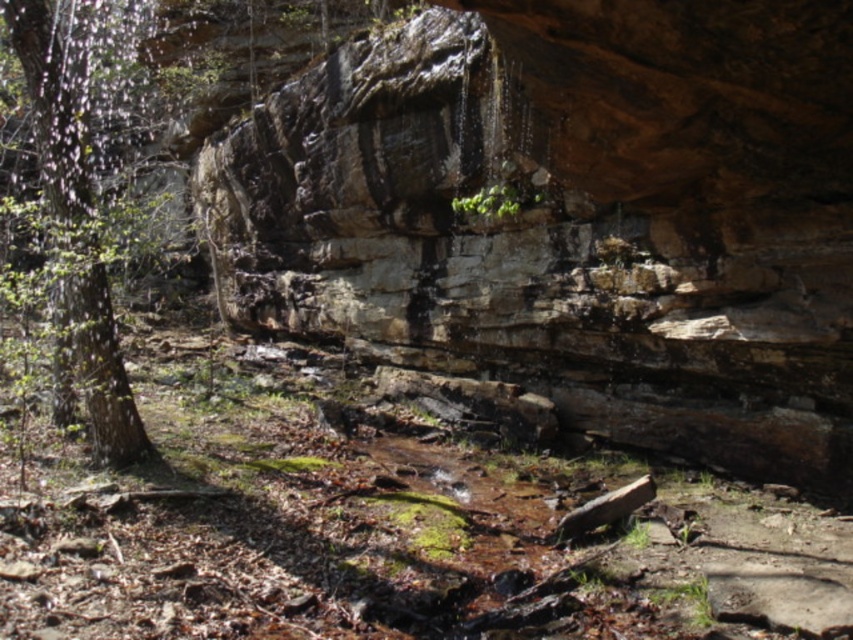
You are a hiker who wants to cross the stream but need to avoid getting your boots wet. You notice the rusty stone cliff at center and the green rough bark tree at left. Which object can you use as a dry path to cross the stream?

The rusty stone cliff at center is located above the green rough bark tree at left, so you can use the rusty stone cliff at center as a dry path to cross the stream since it is elevated.

You are standing in the forest and see the rusty stone cliff at center and the green rough bark tree at left. Which object is positioned to the right of the other?

The rusty stone cliff at center is positioned to the right of the green rough bark tree at left.

You are a hiker trying to cross the stream. You see the rusty stone cliff at center and the green rough bark tree at left. Which object is wider, and can you use either to navigate the stream?

The rusty stone cliff at center is wider than the green rough bark tree at left. Since the cliff is wider, it might provide a more stable path to cross the stream, but you should assess the stability of both before proceeding.